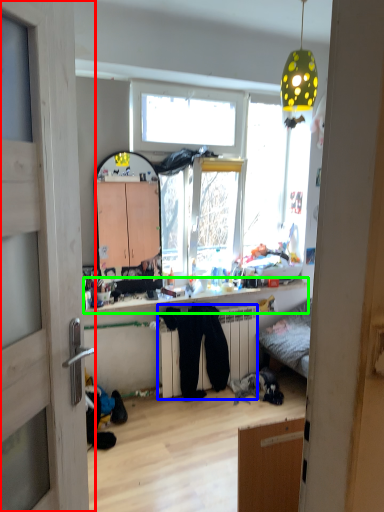
Question: Which object is positioned farthest from door (highlighted by a red box)? Select from radiator (highlighted by a blue box) and counter top (highlighted by a green box).

Choices:
 (A) radiator
 (B) counter top

Answer: (A)